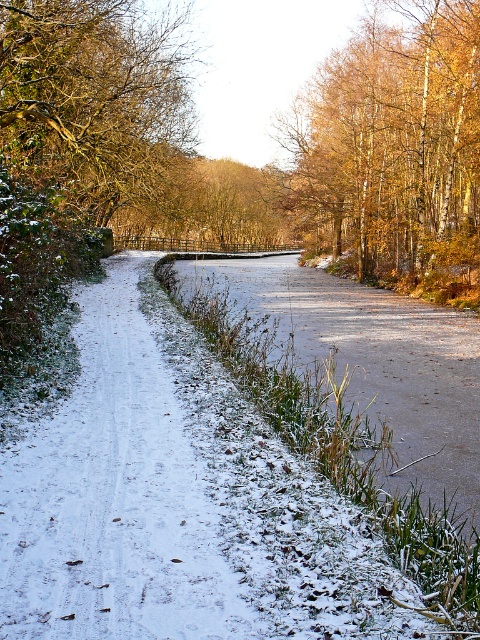
You are standing at the point marked as point (79, 1) and want to walk to point (425, 324) along the road. Given that the road is 5 meters wide, can you walk directly to the destination without crossing the road?

Since point (79, 1) is closer to the viewer than point (425, 324), you can walk directly along the road to reach the destination without crossing the road.